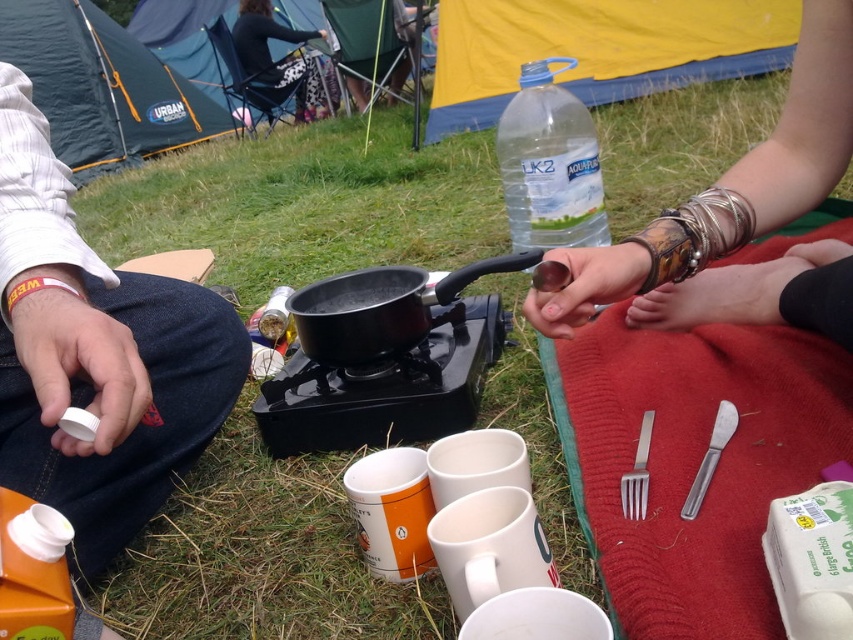
You are a drone operator tasked with capturing aerial footage of the camping scene. The drone is currently hovering at the center of the image. To ensure the blue fabric tent at upper left is in frame, in which direction should you move the drone? Specify the direction as a cardinal direction like north, south, etc.

The blue fabric tent at upper left is located at point (102, 88). Since the drone is at the center, moving it to the northwest would position the tent within the frame.